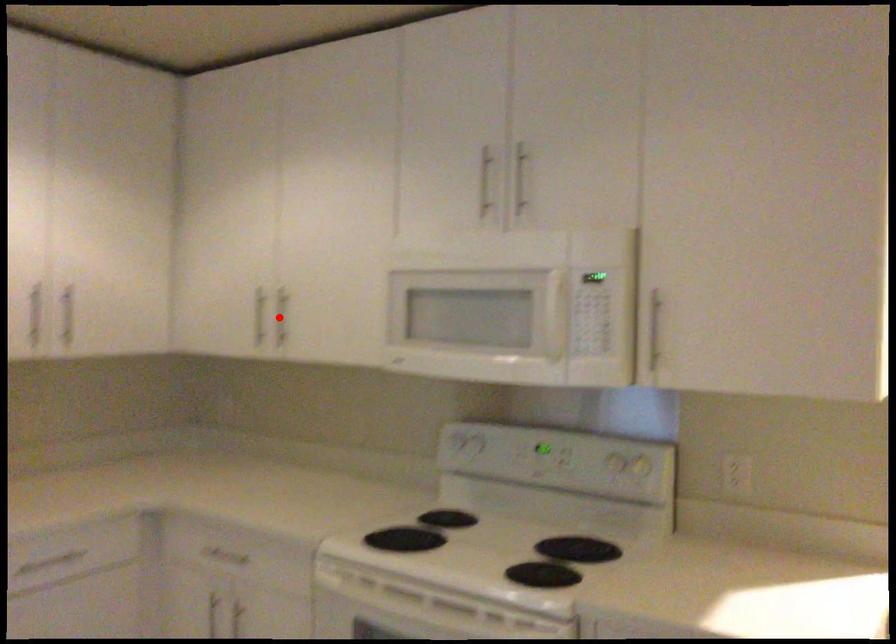
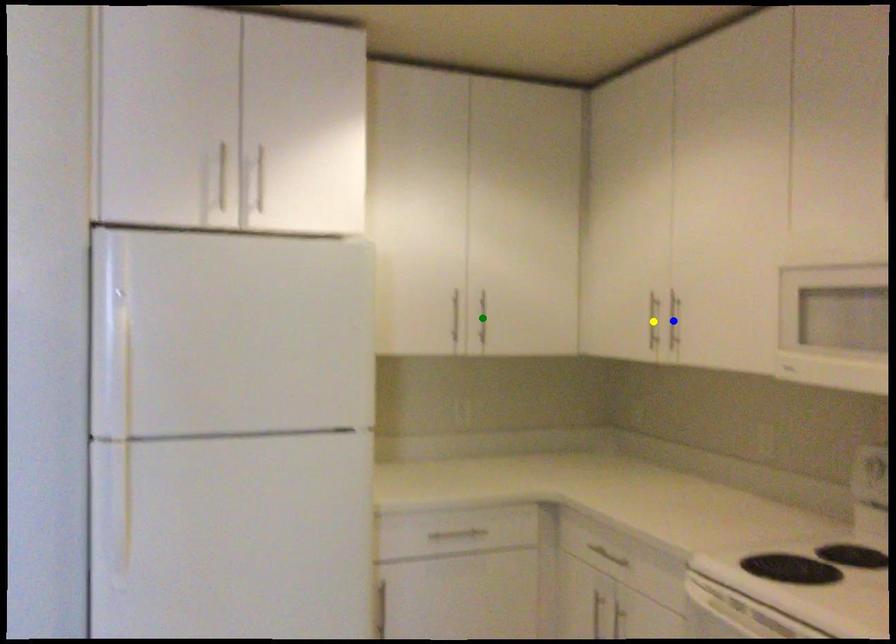
Question: I am providing you with two images of the same scene from different viewpoints. A red point is marked on the first image. You are given multiple points on the second image. Can you choose the point in image 2 that corresponds to the point in image 1?

Choices:
 (A) green point
 (B) yellow point
 (C) blue point

Answer: (C)